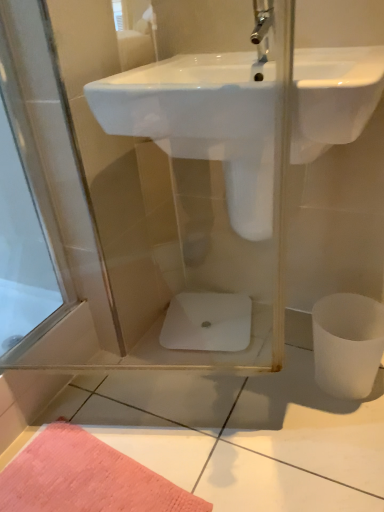
Question: Is white matte toilet bowl at lower right, the second toilet bowl when ordered from left to right, to the left or to the right of white glossy sink at center in the image?

Choices:
 (A) left
 (B) right

Answer: (B)

Question: Is white matte toilet bowl at lower right, the second toilet bowl when ordered from left to right, in front of or behind white glossy sink at center in the image?

Choices:
 (A) behind
 (B) front

Answer: (A)

Question: Estimate the real-world distances between objects in this image. Which object is closer to the white matte toilet bowl at lower right, marked as the 2th toilet bowl in a back-to-front arrangement?

Choices:
 (A) white glossy sink at center
 (B) white glossy toilet bowl at center, the first toilet bowl in the left-to-right sequence

Answer: (B)

Question: Estimate the real-world distances between objects in this image. Which object is closer to the white matte toilet bowl at lower right, the second toilet bowl when ordered from left to right?

Choices:
 (A) white glossy toilet bowl at center, marked as the 2th toilet bowl in a front-to-back arrangement
 (B) white glossy sink at center

Answer: (A)